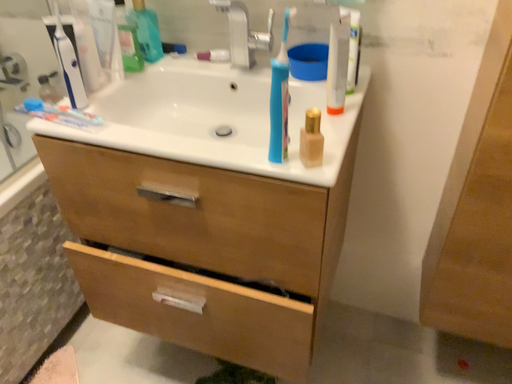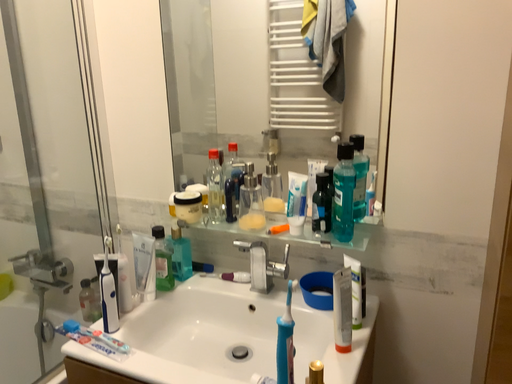
Question: Which way did the camera rotate in the video?

Choices:
 (A) rotated upward
 (B) rotated downward

Answer: (A)